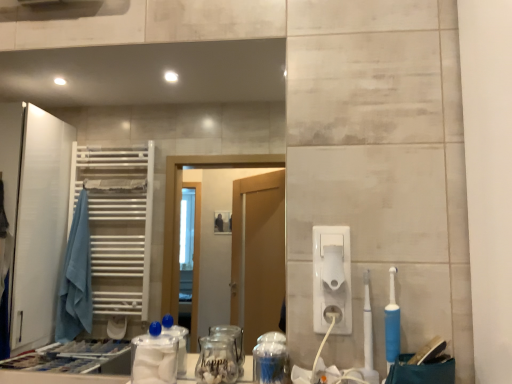
Question: From a real-world perspective, is white plastic hand dryer at right positioned above or below blue rubber toothbrush at right, which is counted as the 2th toothbrush, starting from the left?

Choices:
 (A) above
 (B) below

Answer: (A)

Question: Is white plastic hand dryer at right in front of or behind blue rubber toothbrush at right, acting as the 1th toothbrush starting from the right, in the image?

Choices:
 (A) behind
 (B) front

Answer: (A)

Question: Based on their relative distances, which object is nearer to the blue rubber toothbrush at right, acting as the 1th toothbrush starting from the right?

Choices:
 (A) white plastic toilet paper at center-right
 (B) white plastic hand dryer at right
 (C) transparent glass jar at center, which appears as the 1th glass jar when viewed from the right
 (D) matte white mirror at upper center
 (E) transparent glass jar at center, the 2th glass jar when ordered from right to left

Answer: (B)

Question: Which of these objects is positioned closest to the white plastic hand dryer at right?

Choices:
 (A) blue rubber toothbrush at right, which is counted as the 2th toothbrush, starting from the left
 (B) white plastic toothbrush at right, placed as the 2th toothbrush when sorted from right to left
 (C) transparent glass jar at center, which appears as the 1th glass jar when viewed from the right
 (D) matte white mirror at upper center
 (E) transparent plastic container at center

Answer: (B)